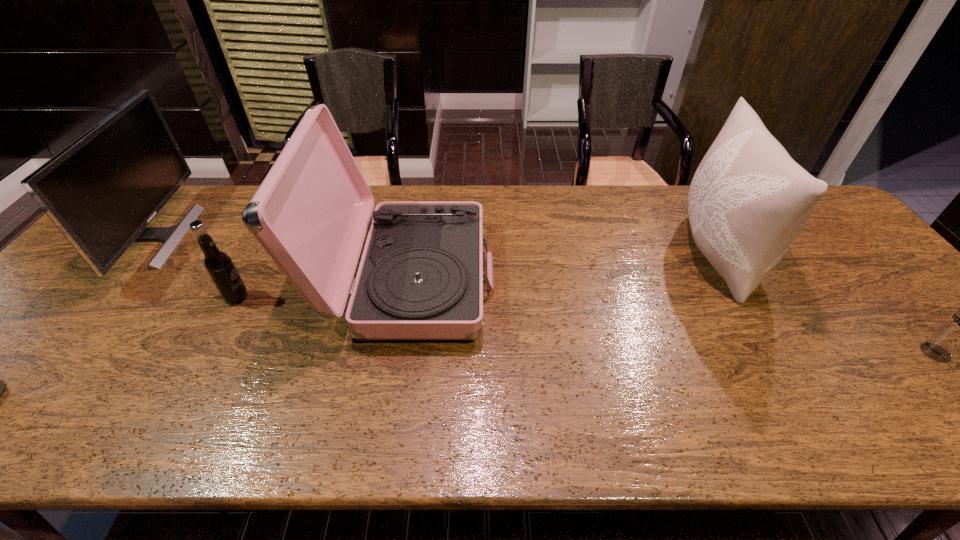
Identify the location of vacant space that's between the cushion and the third object from right to left. (562, 266).

This screenshot has height=540, width=960. I want to click on empty space that is in between the cushion and the third object from left to right, so click(562, 266).

Find the location of `vacant area between the monitor and the root beer`. vacant area between the monitor and the root beer is located at coordinates (198, 267).

Locate an element on the screen. This screenshot has height=540, width=960. object that is the fourth nearest to the cushion is located at coordinates (101, 191).

Identify the location of object that is the third closest one to the third object from left to right. (748, 200).